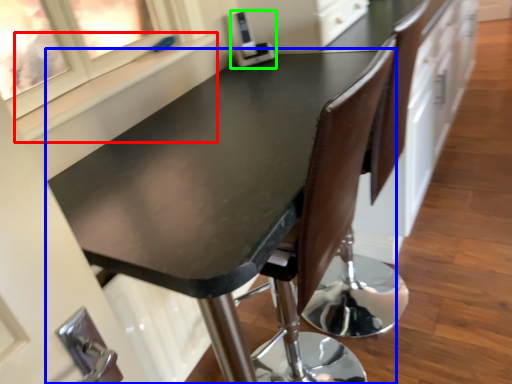
Question: Which object is the farthest from window sill (highlighted by a red box)? Choose among these: table (highlighted by a blue box) or appliance (highlighted by a green box).

Choices:
 (A) table
 (B) appliance

Answer: (B)